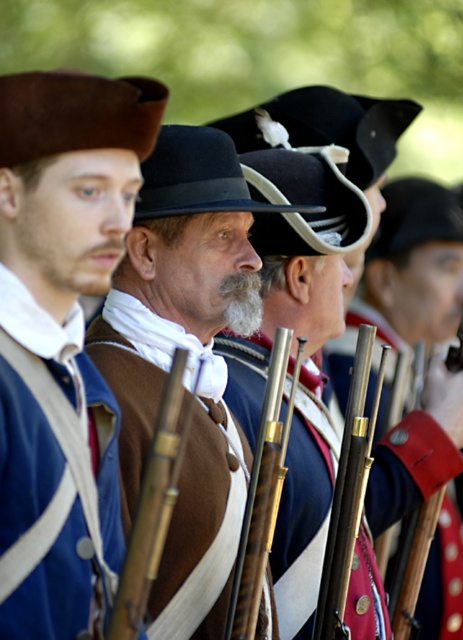
Question: Does shiny gold rifle at center have a smaller size compared to wooden smooth rifle at center?

Choices:
 (A) yes
 (B) no

Answer: (B)

Question: Does brown felt hat at left have a smaller size compared to brass smooth rifle at center?

Choices:
 (A) no
 (B) yes

Answer: (A)

Question: Estimate the real-world distances between objects in this image. Which object is farther from the brown suede hat at center?

Choices:
 (A) wooden smooth rifle at center
 (B) brown felt hat at left
 (C) brass smooth rifle at center

Answer: (B)

Question: Can you confirm if brown felt hat at left is thinner than brass smooth rifle at center?

Choices:
 (A) no
 (B) yes

Answer: (A)

Question: Which of the following is the closest to the observer?

Choices:
 (A) shiny gold rifle at center
 (B) brown felt hat at left
 (C) brown suede hat at center
 (D) brass smooth rifle at center

Answer: (B)

Question: Which point is farther to the camera?

Choices:
 (A) brass smooth rifle at center
 (B) brown suede hat at center
 (C) brown felt hat at left

Answer: (A)